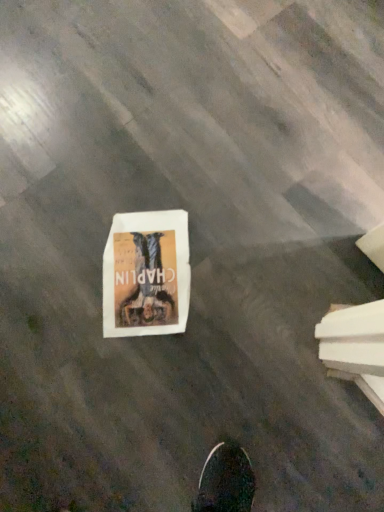
What are the coordinates of `spots to the right of white paper comic book at center` in the screenshot? It's located at (239, 243).